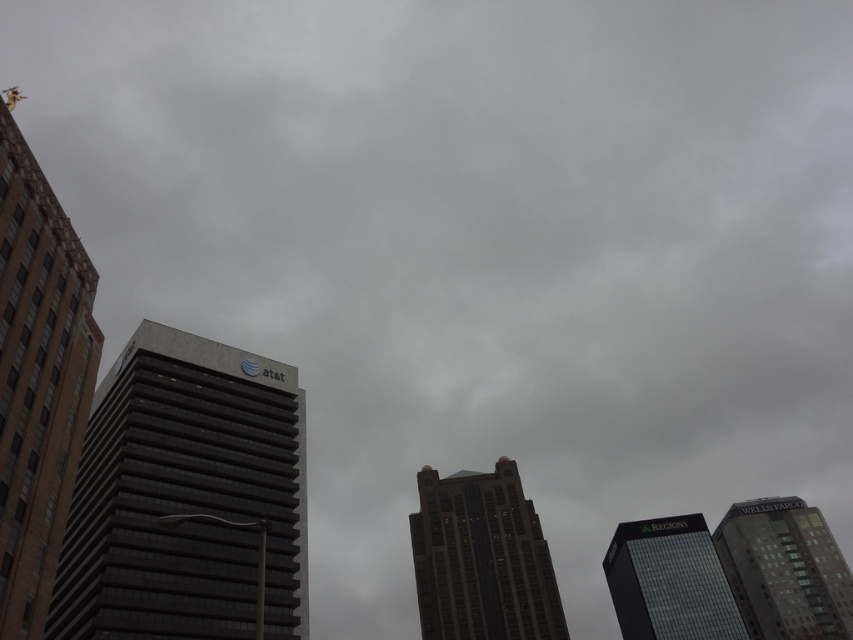
Can you confirm if gray glass building at center is positioned to the left of glassy gray skyscraper at lower right?

Yes, gray glass building at center is to the left of glassy gray skyscraper at lower right.

Can you confirm if gray glass building at center is positioned above glassy gray skyscraper at lower right?

Indeed, gray glass building at center is positioned over glassy gray skyscraper at lower right.

Between point (71, 566) and point (770, 500), which one is positioned behind?

The point (770, 500) is behind.

The height and width of the screenshot is (640, 853). I want to click on gray glass building at center, so click(x=184, y=497).

Does point (22, 442) come farther from viewer compared to point (544, 589)?

No, (22, 442) is closer to viewer.

Which is more to the right, brown glass skyscraper at left or dark glass skyscraper at center?

Positioned to the right is dark glass skyscraper at center.

This screenshot has height=640, width=853. What do you see at coordinates (38, 378) in the screenshot?
I see `brown glass skyscraper at left` at bounding box center [38, 378].

The height and width of the screenshot is (640, 853). What are the coordinates of `brown glass skyscraper at left` in the screenshot? It's located at (38, 378).

Who is higher up, gray glass building at center or glassy black skyscraper at lower right?

gray glass building at center is above.

Is gray glass building at center positioned before glassy black skyscraper at lower right?

Yes, gray glass building at center is closer to the viewer.

Is point (79, 538) positioned behind point (619, 596)?

No.

Identify the location of gray glass building at center. The height and width of the screenshot is (640, 853). (184, 497).